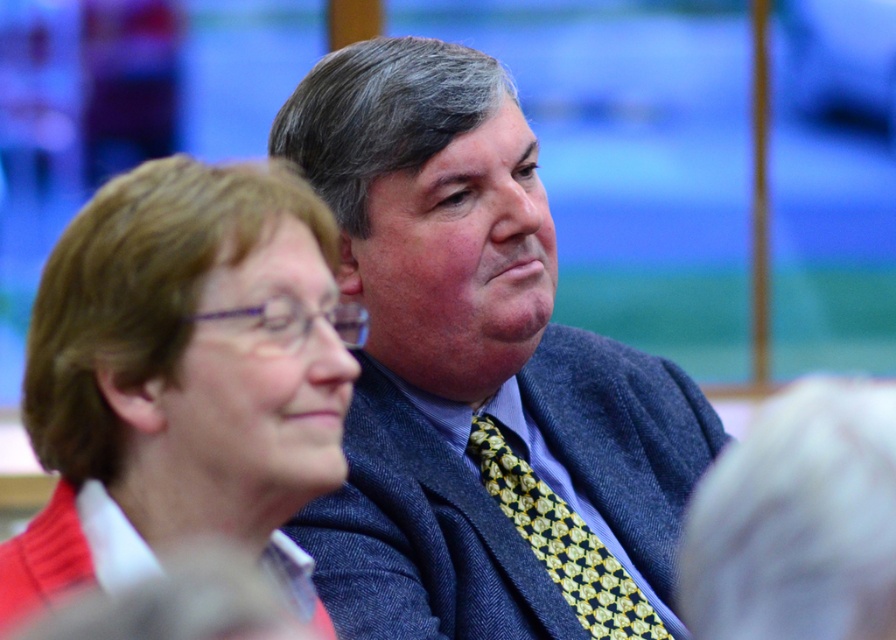
Question: Which object appears farthest from the camera in this image?

Choices:
 (A) blue wool suit at center
 (B) yellow dotted tie at center
 (C) matte red sweater at center-left

Answer: (B)

Question: Which object is the closest to the matte red sweater at center-left?

Choices:
 (A) blue wool suit at center
 (B) yellow dotted tie at center

Answer: (A)

Question: Which point is closer to the camera?

Choices:
 (A) (1, 566)
 (B) (602, 618)

Answer: (A)

Question: Is blue wool suit at center wider than matte red sweater at center-left?

Choices:
 (A) yes
 (B) no

Answer: (A)

Question: Is matte red sweater at center-left smaller than yellow dotted tie at center?

Choices:
 (A) yes
 (B) no

Answer: (B)

Question: Can you confirm if matte red sweater at center-left is bigger than yellow dotted tie at center?

Choices:
 (A) no
 (B) yes

Answer: (B)